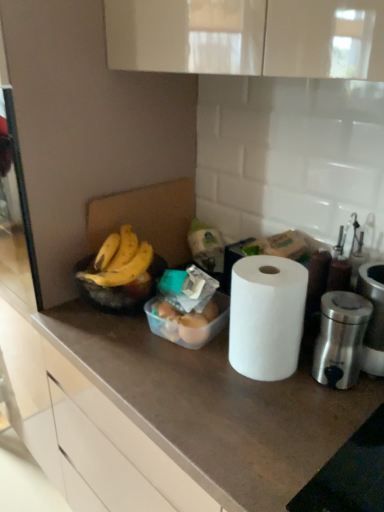
Where is `free space to the left of translucent plastic eggs at center`? free space to the left of translucent plastic eggs at center is located at coordinates (113, 344).